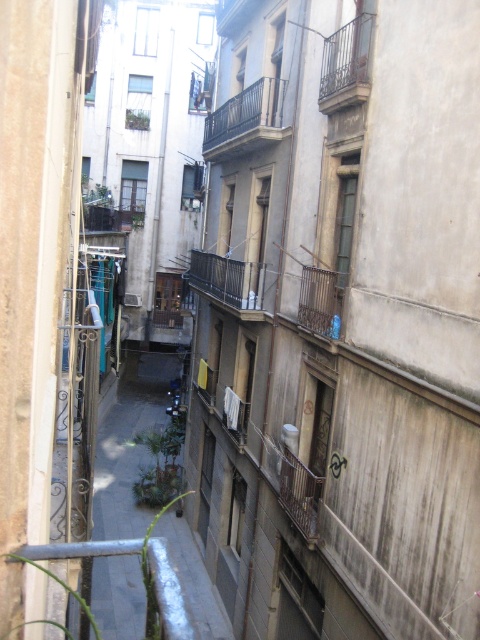
How much distance is there between green leafy plant at center and rusty metal balcony at upper center?

The distance of green leafy plant at center from rusty metal balcony at upper center is 31.81 feet.

Is green leafy plant at center in front of rusty metal balcony at upper center?

Result: Yes.

Locate an element on the screen. green leafy plant at center is located at coordinates pyautogui.click(x=130, y=444).

Is rusty metal balcony at upper center behind rustic metal balcony at center?

No, rusty metal balcony at upper center is closer to the viewer.

Does point (330, 76) come farther from viewer compared to point (206, 262)?

No, it is in front of (206, 262).

Identify the location of rusty metal balcony at upper center. (346, 65).

The width and height of the screenshot is (480, 640). I want to click on green leafy plant at center, so click(130, 444).

Who is lower down, green leafy plant at center or metallic pipe at lower left?

metallic pipe at lower left

The width and height of the screenshot is (480, 640). What do you see at coordinates (130, 444) in the screenshot? I see `green leafy plant at center` at bounding box center [130, 444].

The width and height of the screenshot is (480, 640). Find the location of `green leafy plant at center`. green leafy plant at center is located at coordinates (130, 444).